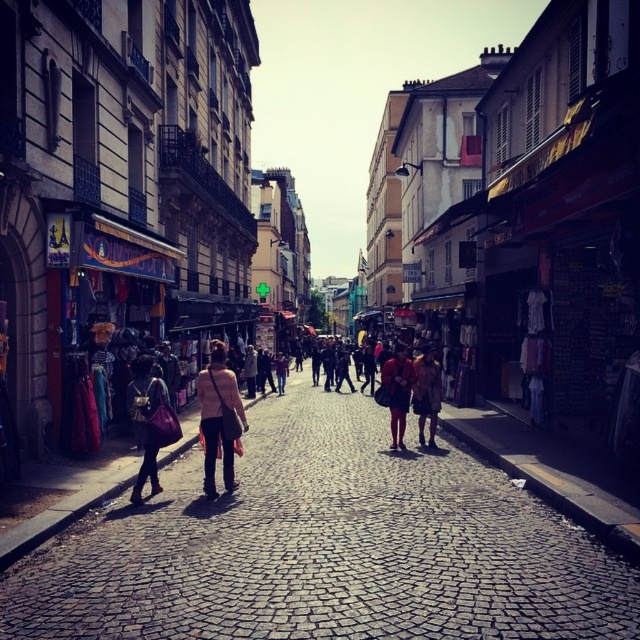
Is light pink fabric jacket at center in front of matte brown dress at center?

Yes.

Does light pink fabric jacket at center appear under matte brown dress at center?

No, light pink fabric jacket at center is not below matte brown dress at center.

Between point (230, 378) and point (435, 433), which one is positioned in front?

Point (230, 378) is in front.

Locate an element on the screen. This screenshot has height=640, width=640. light pink fabric jacket at center is located at coordinates (218, 419).

Who is positioned more to the left, matte pink bag at center or matte black dress at center?

matte pink bag at center is more to the left.

Can you confirm if matte pink bag at center is positioned to the right of matte black dress at center?

In fact, matte pink bag at center is to the left of matte black dress at center.

The width and height of the screenshot is (640, 640). Identify the location of matte pink bag at center. (148, 422).

Is point (154, 515) more distant than point (406, 371)?

No, (154, 515) is in front of (406, 371).

Image resolution: width=640 pixels, height=640 pixels. What are the coordinates of `cobblestone street at center` in the screenshot? It's located at (324, 548).

In order to click on cobblestone street at center in this screenshot , I will do `click(324, 548)`.